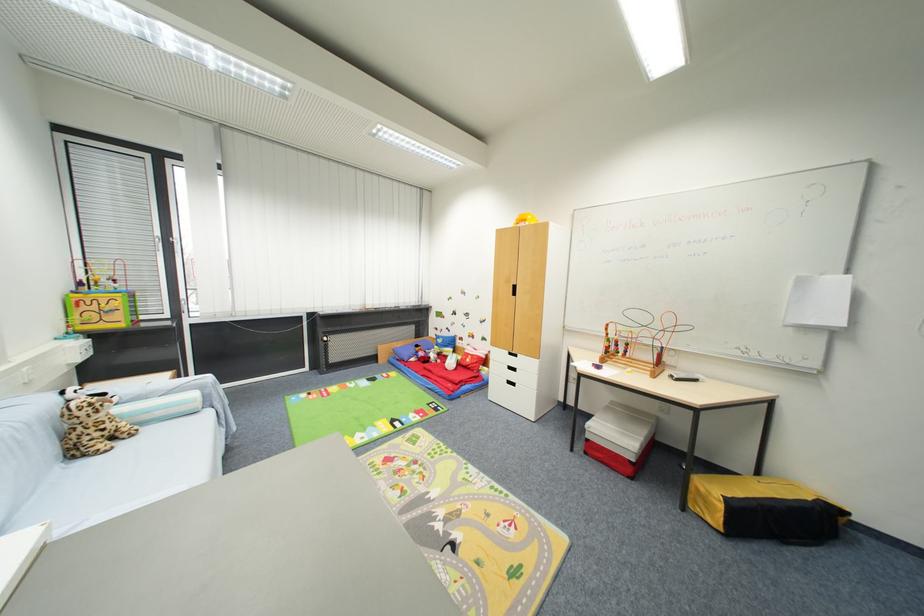
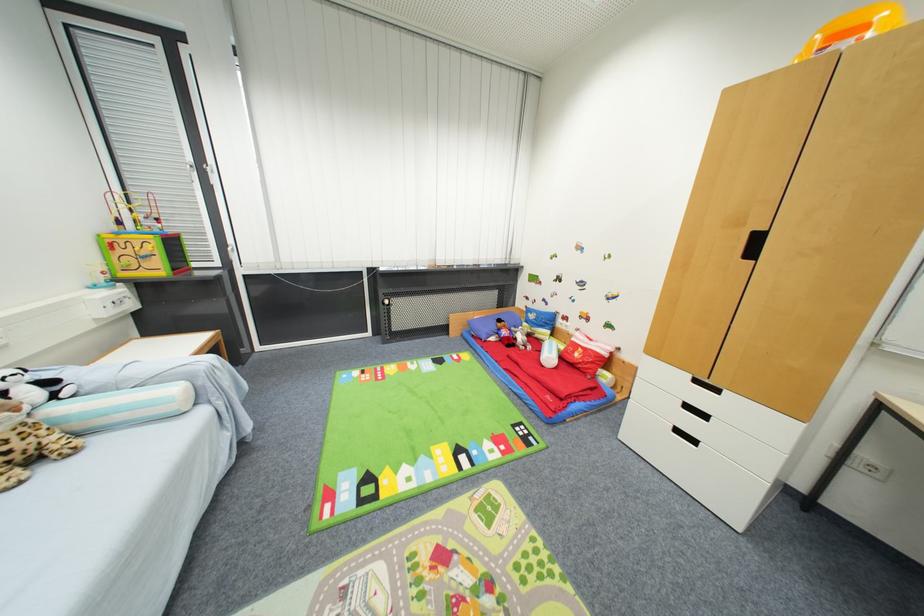
The point at (421,347) is marked in the first image. Where is the corresponding point in the second image?

(505, 323)